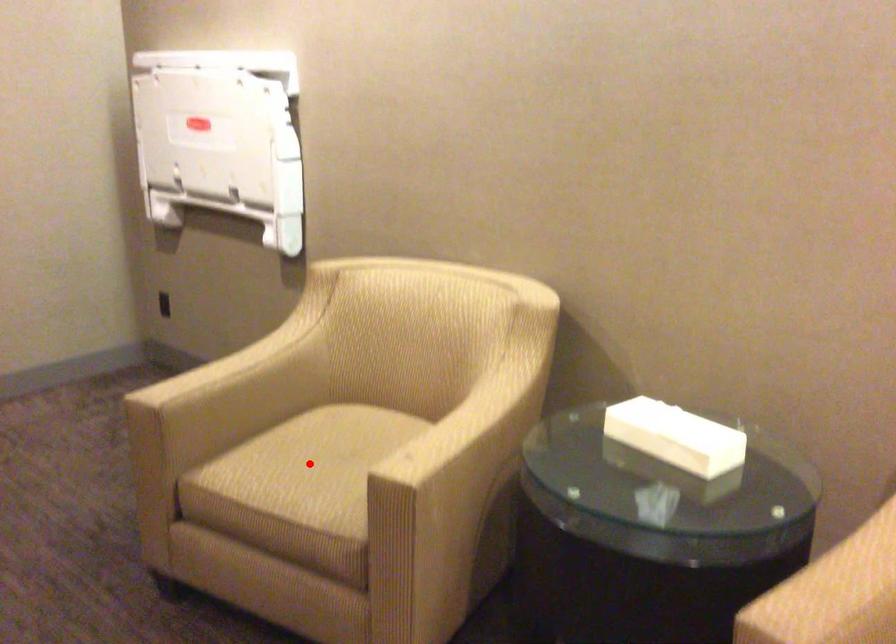
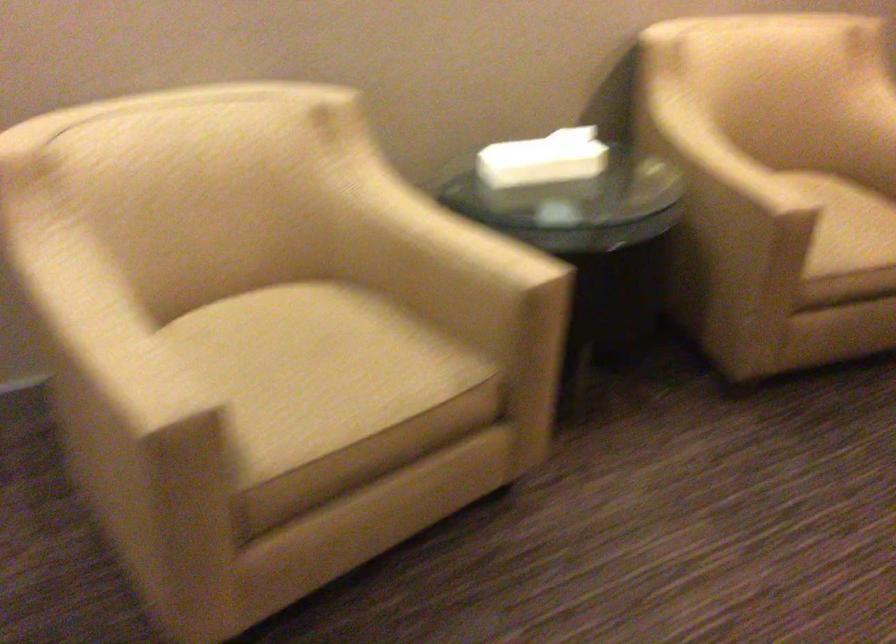
Question: I am providing you with two images of the same scene from different viewpoints. In image1, a red point is highlighted. Considering the same 3D point in image2, which of the following is correct?

Choices:
 (A) It is closer
 (B) It is farther

Answer: (A)